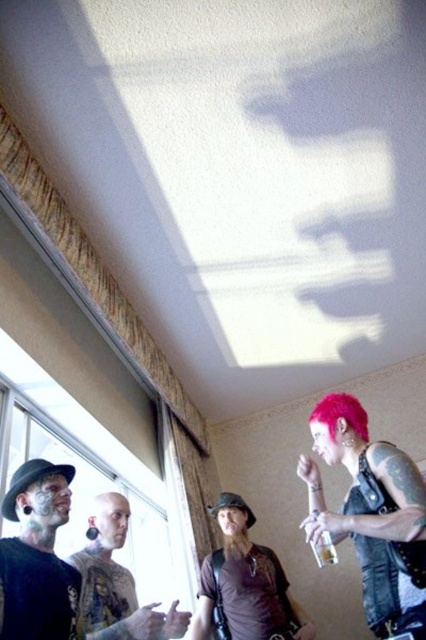
Who is shorter, black leather hat at left or pink matte hair at upper right?

Standing shorter between the two is pink matte hair at upper right.

Can you confirm if black leather hat at left is wider than pink matte hair at upper right?

Yes, black leather hat at left is wider than pink matte hair at upper right.

Which is in front, point (45, 460) or point (311, 412)?

Point (45, 460) is in front.

Find the location of `black leather hat at left`. black leather hat at left is located at coordinates click(x=37, y=556).

Which is more to the left, black leather hat at left or black tattooed skin at lower left?

black leather hat at left is more to the left.

Image resolution: width=426 pixels, height=640 pixels. I want to click on black leather hat at left, so click(x=37, y=556).

Between point (45, 481) and point (109, 506), which one is positioned in front?

Point (45, 481) is more forward.

At what (x,y) coordinates should I click in order to perform the action: click on black leather hat at left. Please return your answer as a coordinate pair (x, y). Looking at the image, I should click on (37, 556).

Between point (91, 627) and point (319, 420), which one is positioned in front?

Positioned in front is point (319, 420).

Is black tattooed skin at lower left wider than pink matte hair at upper right?

Indeed, black tattooed skin at lower left has a greater width compared to pink matte hair at upper right.

Locate an element on the screen. black tattooed skin at lower left is located at coordinates (117, 582).